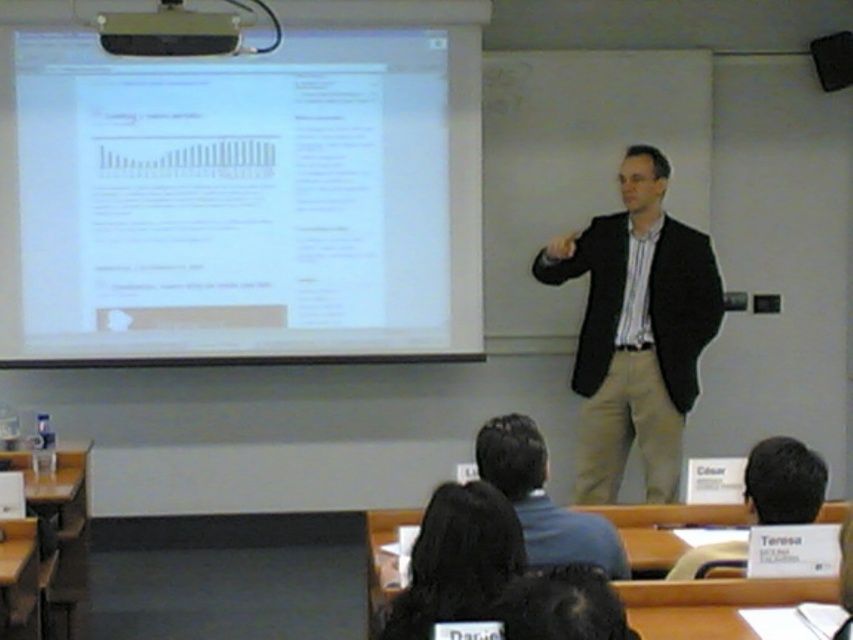
You are a student sitting in the classroom and you want to see both the blue shirt at center and the black plastic projector at upper center clearly. Which one do you need to move closer to the front of the classroom to see better?

The blue shirt at center is larger in size than the black plastic projector at upper center, so you need to move closer to the black plastic projector at upper center to see it better.

You are a student sitting in the classroom and want to refer to both the white paper at upper left and the blue shirt at center. Which object should you look to your left first before looking towards the center?

The white paper at upper left is to the left of the blue shirt at center, so you should look to the white paper at upper left first before looking towards the blue shirt at center.